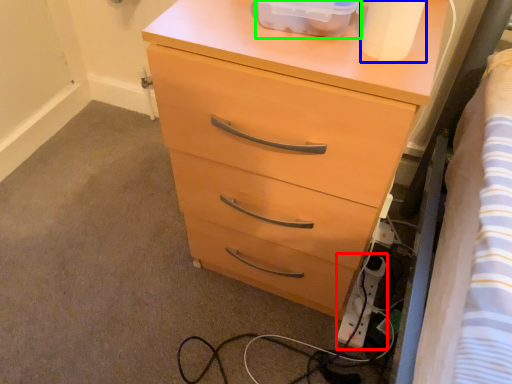
Question: Which object is positioned farthest from extension cord (highlighted by a red box)? Select from toilet paper (highlighted by a blue box) and storage box (highlighted by a green box).

Choices:
 (A) toilet paper
 (B) storage box

Answer: (B)